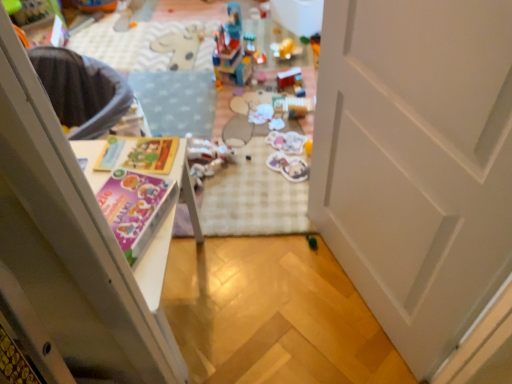
You are a GUI agent. You are given a task and a screenshot of the screen. Output one action in this format:
    pyautogui.click(x=<x>, y=<y>)
    Task: Click on the free point behind matte plastic stickers at center, the second toy from the bottom
    The width and height of the screenshot is (512, 384).
    Given the screenshot: What is the action you would take?
    pyautogui.click(x=279, y=140)